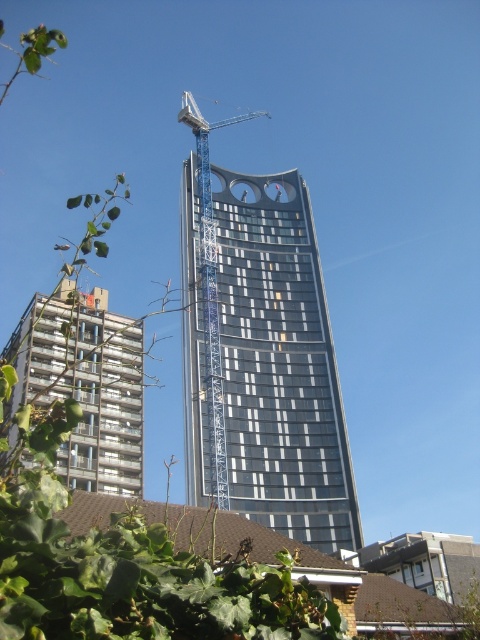
Image resolution: width=480 pixels, height=640 pixels. I want to click on glassy steel tower at center, so click(260, 353).

Is glassy steel tower at center to the right of blue metallic crane at center from the viewer's perspective?

Correct, you'll find glassy steel tower at center to the right of blue metallic crane at center.

Between point (308, 200) and point (203, 301), which one is positioned behind?

The point (308, 200) is more distant.

This screenshot has width=480, height=640. Find the location of `glassy steel tower at center`. glassy steel tower at center is located at coordinates (260, 353).

Does metallic silver building at lower left have a greater width compared to blue metallic crane at center?

Correct, the width of metallic silver building at lower left exceeds that of blue metallic crane at center.

Is metallic silver building at lower left closer to the viewer compared to blue metallic crane at center?

Yes, metallic silver building at lower left is in front of blue metallic crane at center.

Who is more forward, (85, 476) or (201, 129)?

Positioned in front is point (85, 476).

Image resolution: width=480 pixels, height=640 pixels. In order to click on metallic silver building at lower left in this screenshot , I will do `click(85, 385)`.

Who is higher up, glassy steel tower at center or metallic silver building at lower left?

Positioned higher is glassy steel tower at center.

Who is positioned more to the left, glassy steel tower at center or metallic silver building at lower left?

metallic silver building at lower left is more to the left.

Who is more distant from viewer, (213, 368) or (73, 396)?

The point (213, 368) is behind.

Where is `glassy steel tower at center`? The image size is (480, 640). glassy steel tower at center is located at coordinates (260, 353).